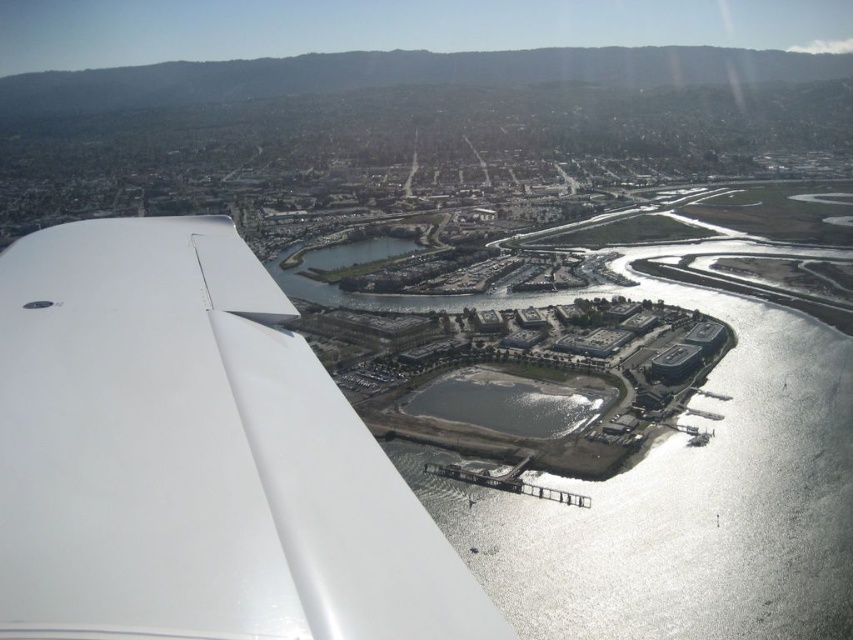
Question: Can you confirm if white glossy wing at left is thinner than gray concrete waterway at center?

Choices:
 (A) yes
 (B) no

Answer: (B)

Question: Observing the image, what is the correct spatial positioning of white glossy wing at left in reference to gray concrete waterway at center?

Choices:
 (A) below
 (B) above

Answer: (A)

Question: Is white glossy wing at left thinner than gray concrete waterway at center?

Choices:
 (A) yes
 (B) no

Answer: (B)

Question: Which point appears closest to the camera in this image?

Choices:
 (A) (537, 426)
 (B) (3, 291)

Answer: (B)

Question: Which of the following is the farthest from the observer?

Choices:
 (A) [525, 422]
 (B) [392, 618]

Answer: (A)